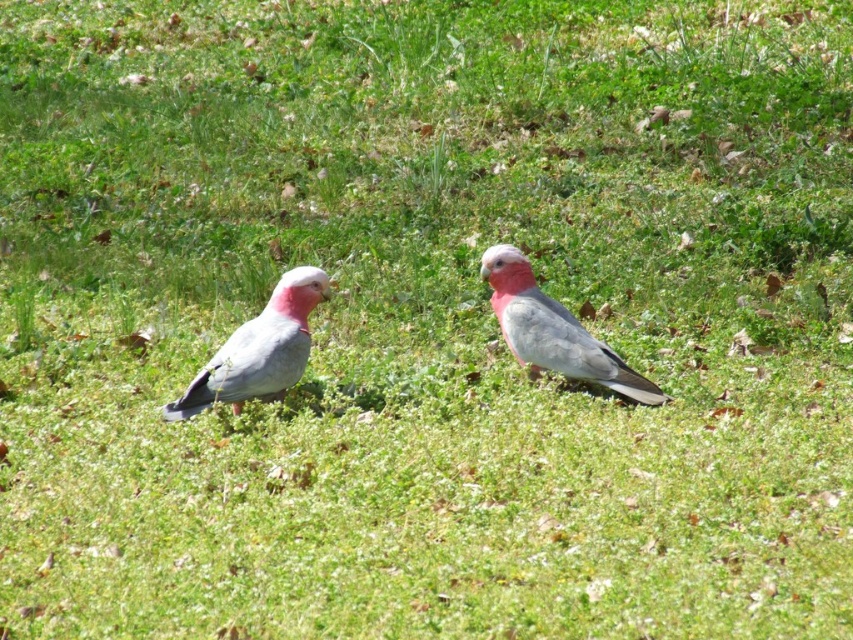
Question: From the image, what is the correct spatial relationship of matte gray bird at center in relation to pink feathered parrot at center?

Choices:
 (A) left
 (B) right

Answer: (A)

Question: Which point is closer to the camera?

Choices:
 (A) (502, 291)
 (B) (283, 282)

Answer: (B)

Question: Which point is farther to the camera?

Choices:
 (A) (495, 273)
 (B) (279, 288)

Answer: (A)

Question: Can you confirm if matte gray bird at center is positioned to the right of pink feathered parrot at center?

Choices:
 (A) no
 (B) yes

Answer: (A)

Question: Can you confirm if matte gray bird at center is wider than pink feathered parrot at center?

Choices:
 (A) no
 (B) yes

Answer: (A)